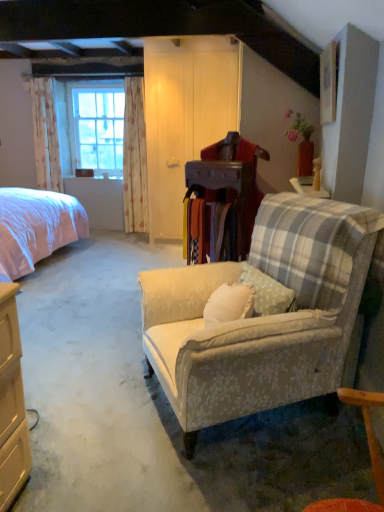
Question: Is wooden picture frame at upper right wider or thinner than white floral fabric curtain at left, the first curtain positioned from the left?

Choices:
 (A) wide
 (B) thin

Answer: (B)

Question: Considering their positions, is wooden picture frame at upper right located in front of or behind white floral fabric curtain at left, arranged as the 2th curtain when viewed from the right?

Choices:
 (A) front
 (B) behind

Answer: (A)

Question: Estimate the real-world distances between objects in this image. Which object is farther from the pink fabric bed at left?

Choices:
 (A) floral fabric curtain at left, which is counted as the 1th curtain, starting from the right
 (B) white floral fabric curtain at left, the first curtain positioned from the left
 (C) clear glass window at left
 (D) floral fabric armchair at center
 (E) wooden picture frame at upper right

Answer: (E)

Question: Estimate the real-world distances between objects in this image. Which object is farther from the pink fabric bed at left?

Choices:
 (A) floral fabric armchair at center
 (B) white floral fabric curtain at left, arranged as the 2th curtain when viewed from the right
 (C) clear glass window at left
 (D) floral fabric curtain at left, which appears as the second curtain when viewed from the left
 (E) wooden picture frame at upper right

Answer: (E)